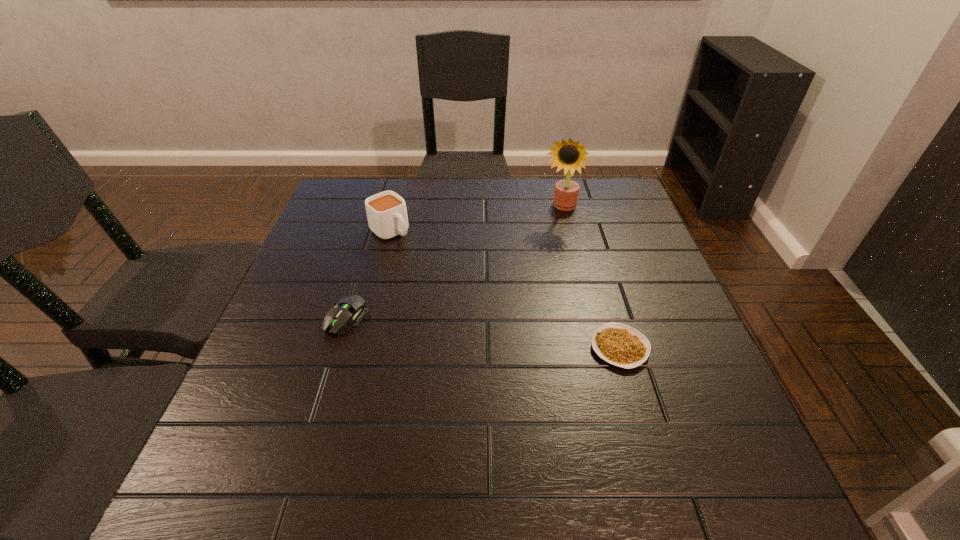
Locate an element on the screen. the third tallest object is located at coordinates (351, 309).

This screenshot has width=960, height=540. In order to click on legume in this screenshot , I will do `click(621, 345)`.

Image resolution: width=960 pixels, height=540 pixels. I want to click on the second tallest object, so click(x=386, y=212).

You are a GUI agent. You are given a task and a screenshot of the screen. Output one action in this format:
    pyautogui.click(x=<x>, y=<y>)
    Task: Click on the sunflower
    
    Given the screenshot: What is the action you would take?
    pyautogui.click(x=569, y=155)

At what (x,y) coordinates should I click in order to perform the action: click on free space located 0.050m on the left of the computer mouse. Please return your answer as a coordinate pair (x, y). Looking at the image, I should click on (304, 318).

The image size is (960, 540). In order to click on vacant space located 0.330m on the left of the shortest object in this screenshot , I will do `click(431, 348)`.

Locate an element on the screen. Image resolution: width=960 pixels, height=540 pixels. vacant space situated 0.300m on the side with the handle of the second tallest object is located at coordinates (473, 305).

Identify the location of free space located 0.080m on the side with the handle of the second tallest object. The width and height of the screenshot is (960, 540). (419, 258).

You are a GUI agent. You are given a task and a screenshot of the screen. Output one action in this format:
    pyautogui.click(x=<x>, y=<y>)
    Task: Click on the vacant space positioned 0.370m on the side with the handle of the second tallest object
    The image size is (960, 540).
    Given the screenshot: What is the action you would take?
    [493, 322]

Find the location of a particular element. The height and width of the screenshot is (540, 960). vacant space located on the face of the tallest object is located at coordinates (527, 276).